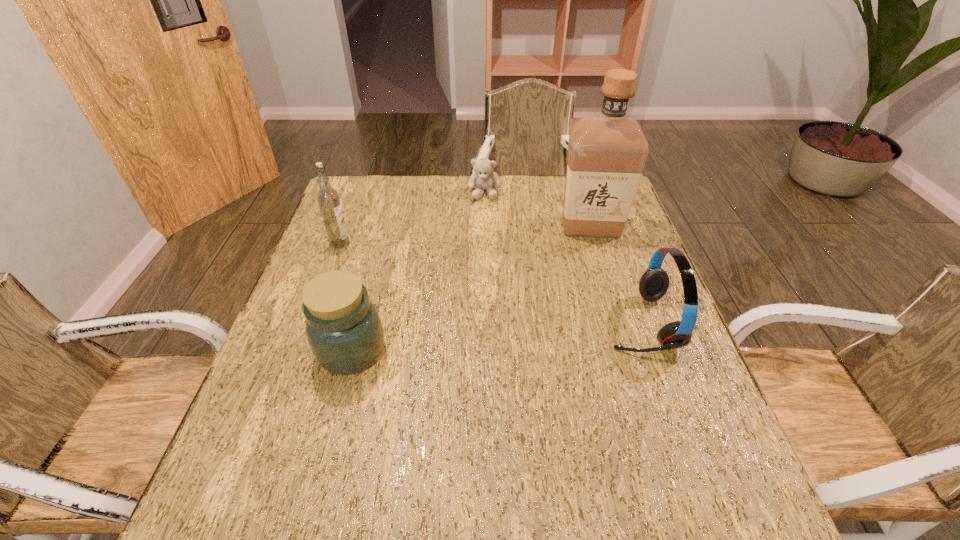
Where is `jar`? jar is located at coordinates (343, 327).

Locate an element on the screen. This screenshot has width=960, height=540. headset is located at coordinates (653, 284).

You are a GUI agent. You are given a task and a screenshot of the screen. Output one action in this format:
    pyautogui.click(x=<x>, y=<y>)
    Task: Click on the leftmost object
    The height and width of the screenshot is (540, 960).
    Given the screenshot: What is the action you would take?
    pyautogui.click(x=327, y=197)

This screenshot has width=960, height=540. What are the coordinates of `vodka` in the screenshot? It's located at (327, 197).

Image resolution: width=960 pixels, height=540 pixels. Identify the location of liquor. (607, 152).

Find the location of a particular element. The height and width of the screenshot is (540, 960). teddy bear is located at coordinates (484, 178).

The image size is (960, 540). In order to click on the third object from right to left in this screenshot , I will do `click(484, 178)`.

Locate an element on the screen. vacant space located on the right of the fourth object from right to left is located at coordinates (413, 350).

What are the coordinates of `vacant space located 0.380m with the microphone attached to the side of the headset` in the screenshot? It's located at (445, 322).

You are a GUI agent. You are given a task and a screenshot of the screen. Output one action in this format:
    pyautogui.click(x=<x>, y=<y>)
    Task: Click on the vacant region located with the microphone attached to the side of the headset
    The width and height of the screenshot is (960, 540).
    Given the screenshot: What is the action you would take?
    (581, 322)